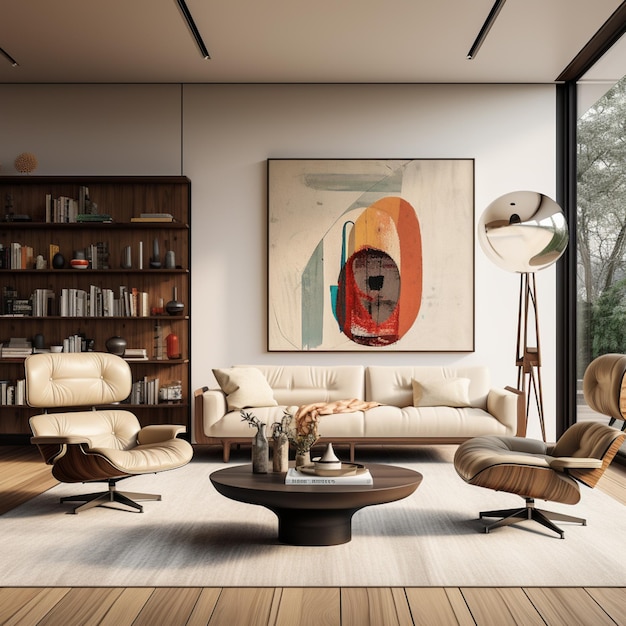
I want to click on vase, so click(259, 453), click(277, 449), click(302, 453).